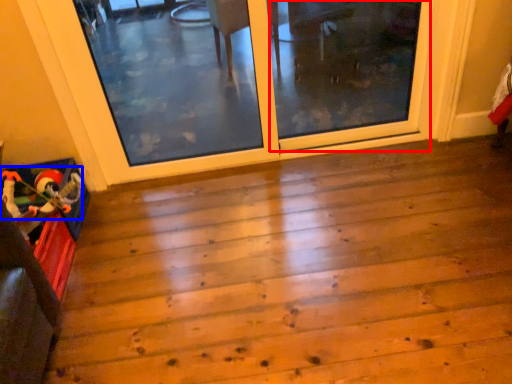
Question: Which of the following is the closest to the observer, screen door (highlighted by a red box) or toy (highlighted by a blue box)?

Choices:
 (A) screen door
 (B) toy

Answer: (B)